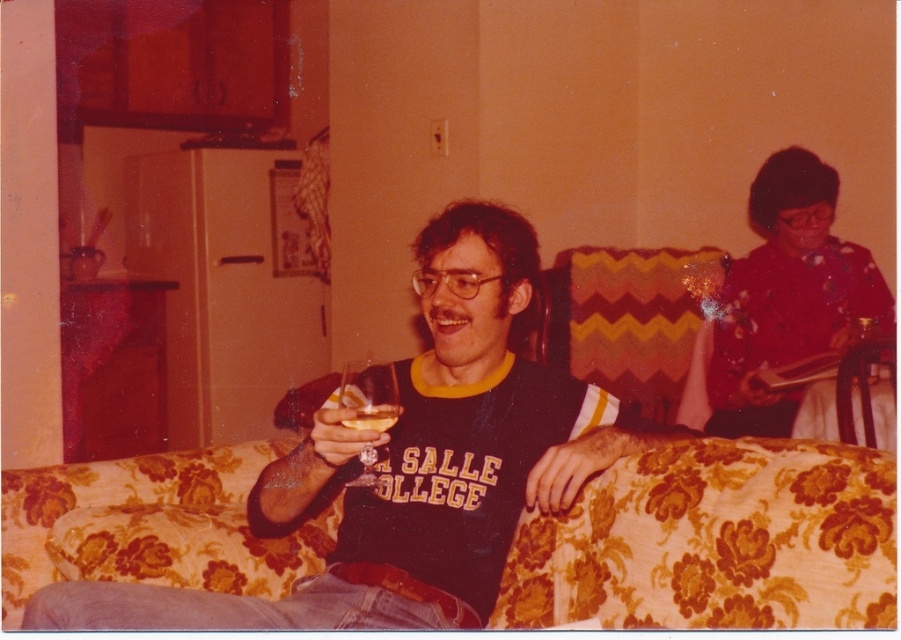
In the scene, there are two glasses at the center of the image. Which one is closer to you, the clear glass wine glass at center or the translucent glass at center?

The clear glass wine glass at center is closer to you than the translucent glass at center.